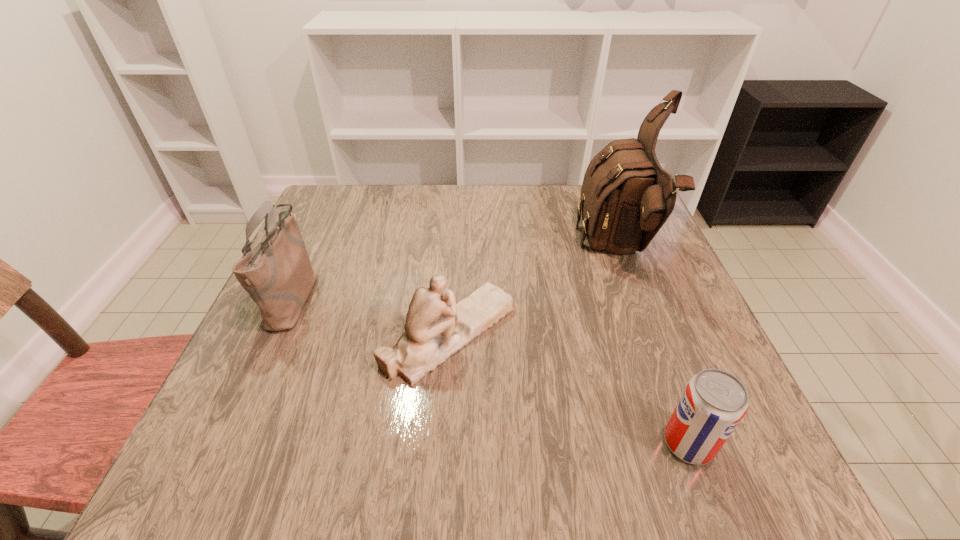
Image resolution: width=960 pixels, height=540 pixels. Find the location of `blank area located on the front-facing side of the figurine`. blank area located on the front-facing side of the figurine is located at coordinates (587, 334).

Locate an element on the screen. vacant space located 0.370m on the left of the soda is located at coordinates (436, 443).

At what (x,y) coordinates should I click in order to perform the action: click on object located at the far edge. Please return your answer as a coordinate pair (x, y). This screenshot has height=540, width=960. Looking at the image, I should click on (626, 197).

Identify the location of object that is positioned at the near edge. (714, 401).

Where is `object at the left edge`? object at the left edge is located at coordinates (277, 274).

You are a GUI agent. You are given a task and a screenshot of the screen. Output one action in this format:
    pyautogui.click(x=<x>, y=<y>)
    Task: Click on the shoulder bag that is at the right edge
    The height and width of the screenshot is (540, 960).
    Given the screenshot: What is the action you would take?
    pyautogui.click(x=626, y=197)

You are a GUI agent. You are given a task and a screenshot of the screen. Output one action in this format:
    pyautogui.click(x=<x>, y=<y>)
    Task: Click on the soda situated at the right edge
    
    Given the screenshot: What is the action you would take?
    pyautogui.click(x=714, y=401)

Where is `object present at the far right corner`? object present at the far right corner is located at coordinates (626, 197).

You are a GUI agent. You are given a task and a screenshot of the screen. Output one action in this format:
    pyautogui.click(x=<x>, y=<y>)
    Task: Click on the object that is at the near right corner
    The height and width of the screenshot is (540, 960).
    Given the screenshot: What is the action you would take?
    pyautogui.click(x=714, y=401)

In the image, there is a desktop. Identify the location of free space at the far edge. (414, 200).